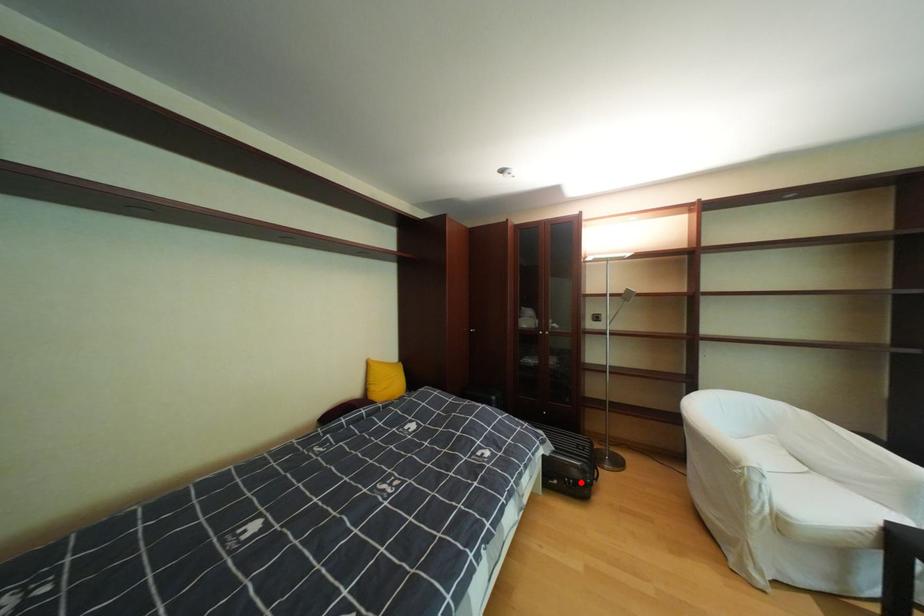
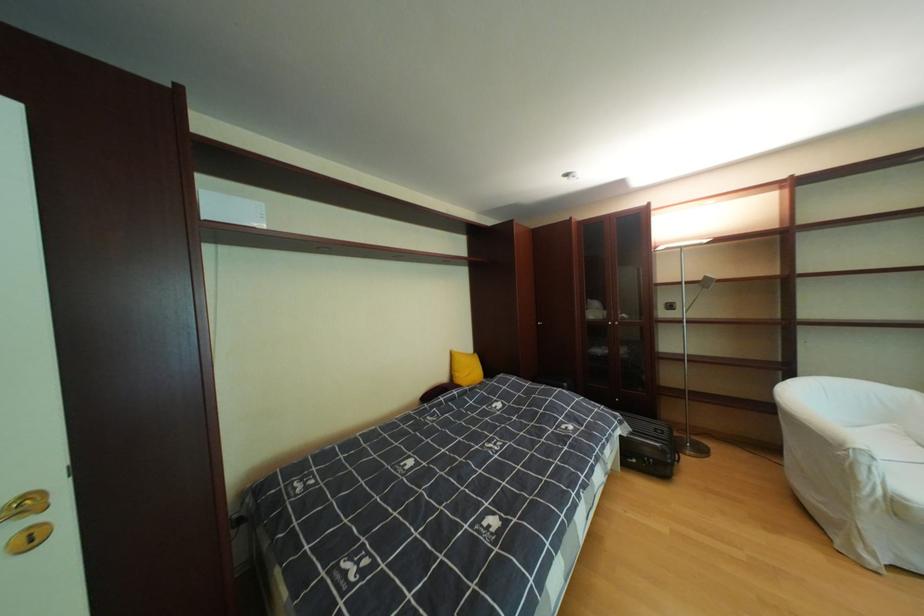
In the second image, find the point that corresponds to the highlighted location in the first image.

(661, 461)